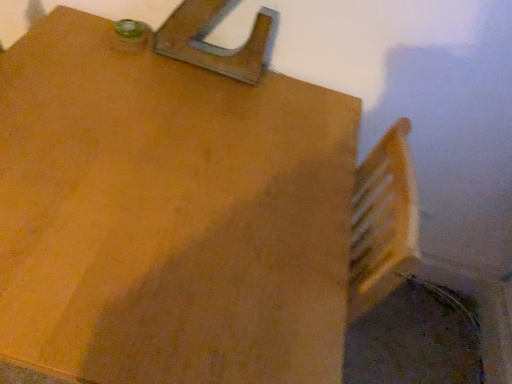
Question: From the image's perspective, relative to wooden at upper center, is matte wood table at upper left above or below?

Choices:
 (A) above
 (B) below

Answer: (B)

Question: Looking at their shapes, would you say matte wood table at upper left is wider or thinner than wooden at upper center?

Choices:
 (A) wide
 (B) thin

Answer: (A)

Question: Relative to wooden at upper center, is matte wood table at upper left in front or behind?

Choices:
 (A) behind
 (B) front

Answer: (B)

Question: Is point (210, 69) positioned closer to the camera than point (208, 82)?

Choices:
 (A) farther
 (B) closer

Answer: (A)

Question: Choose the correct answer: Is wooden at upper center inside matte wood table at upper left or outside it?

Choices:
 (A) inside
 (B) outside

Answer: (B)

Question: Visually, is wooden at upper center positioned to the left or to the right of matte wood table at upper left?

Choices:
 (A) right
 (B) left

Answer: (A)

Question: Considering the positions of wooden at upper center and matte wood table at upper left in the image, is wooden at upper center taller or shorter than matte wood table at upper left?

Choices:
 (A) short
 (B) tall

Answer: (A)